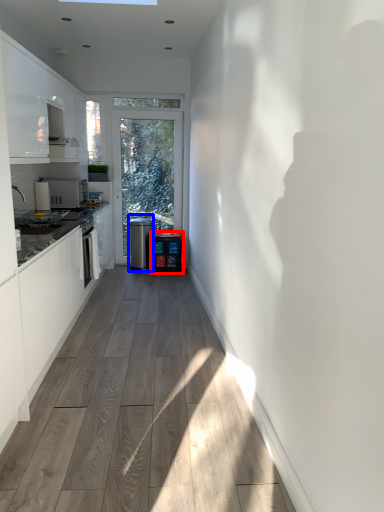
Question: Which of the following is the closest to the observer, water cooler (highlighted by a red box) or water cooler (highlighted by a blue box)?

Choices:
 (A) water cooler
 (B) water cooler

Answer: (A)